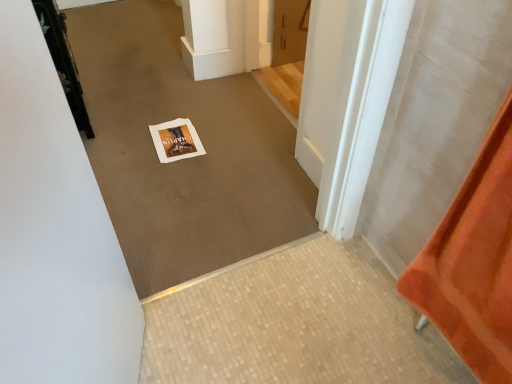
The height and width of the screenshot is (384, 512). Describe the element at coordinates (185, 159) in the screenshot. I see `white paper at center` at that location.

This screenshot has width=512, height=384. What do you see at coordinates (290, 31) in the screenshot?
I see `matte wood door at upper center, placed as the first door when sorted from right to left` at bounding box center [290, 31].

Where is `white paper at center`? The width and height of the screenshot is (512, 384). white paper at center is located at coordinates (176, 140).

Where is `white paper at center`? The image size is (512, 384). white paper at center is located at coordinates (185, 159).

Does white paper at center have a lesser width compared to white paper at center?

In fact, white paper at center might be wider than white paper at center.

Can you confirm if white paper at center is taller than white paper at center?

No.

In the scene shown: Considering their positions, is white paper at center located in front of or behind white paper at center?

In the image, white paper at center appears behind white paper at center.

Does white paper at center turn towards white paper at center?

No.

Is point (301, 60) more distant than point (188, 144)?

Yes, point (301, 60) is behind point (188, 144).

Between matte wood door at upper center, the second door viewed from the left, and white paper at center, which one has less height?

Standing shorter between the two is white paper at center.

Is matte wood door at upper center, the second door viewed from the left, oriented towards white paper at center?

No, matte wood door at upper center, the second door viewed from the left, is not turned towards white paper at center.

Is point (295, 56) positioned before point (293, 193)?

No, it is behind (293, 193).

Is white paper at center at the back of matte wood door at upper center, placed as the first door when sorted from right to left?

No, matte wood door at upper center, placed as the first door when sorted from right to left, is not facing the opposite direction of white paper at center.

Does matte wood door at upper center, placed as the first door when sorted from right to left, come behind white paper at center?

Yes, matte wood door at upper center, placed as the first door when sorted from right to left, is further from the camera.

In the scene shown: Are matte wood door at upper center, the second door viewed from the left, and white paper at center beside each other?

No, matte wood door at upper center, the second door viewed from the left, is not in contact with white paper at center.

Is matte wood door at upper center, placed as the first door when sorted from right to left, smaller than black metal door at upper left, the first door in the left-to-right sequence?

Yes, matte wood door at upper center, placed as the first door when sorted from right to left, is smaller than black metal door at upper left, the first door in the left-to-right sequence.

Is the depth of matte wood door at upper center, placed as the first door when sorted from right to left, greater than that of black metal door at upper left, which is the 2th door in right-to-left order?

That is True.

In the scene shown: How far apart are matte wood door at upper center, placed as the first door when sorted from right to left, and black metal door at upper left, the first door in the left-to-right sequence?

matte wood door at upper center, placed as the first door when sorted from right to left, is 1.18 meters from black metal door at upper left, the first door in the left-to-right sequence.

Is matte wood door at upper center, the second door viewed from the left, to the left of black metal door at upper left, which is the 2th door in right-to-left order, from the viewer's perspective?

Incorrect, matte wood door at upper center, the second door viewed from the left, is not on the left side of black metal door at upper left, which is the 2th door in right-to-left order.

Between black metal door at upper left, which is the 2th door in right-to-left order, and white paper at center, which one has less height?

white paper at center.

Considering the relative positions of black metal door at upper left, which is the 2th door in right-to-left order, and white paper at center in the image provided, is black metal door at upper left, which is the 2th door in right-to-left order, to the right of white paper at center from the viewer's perspective?

Incorrect, black metal door at upper left, which is the 2th door in right-to-left order, is not on the right side of white paper at center.

Where is `postcard below the black metal door at upper left, the first door in the left-to-right sequence (from a real-world perspective)`? postcard below the black metal door at upper left, the first door in the left-to-right sequence (from a real-world perspective) is located at coordinates click(x=176, y=140).

How many degrees apart are the facing directions of black metal door at upper left, the first door in the left-to-right sequence, and white paper at center?

The facing directions of black metal door at upper left, the first door in the left-to-right sequence, and white paper at center are 86.3 degrees apart.

Considering the relative sizes of white paper at center and matte wood door at upper center, the second door viewed from the left, in the image provided, is white paper at center thinner than matte wood door at upper center, the second door viewed from the left,?

No.

Is white paper at center behind matte wood door at upper center, the second door viewed from the left?

No, it is in front of matte wood door at upper center, the second door viewed from the left.

Considering the sizes of white paper at center and matte wood door at upper center, the second door viewed from the left, in the image, is white paper at center taller or shorter than matte wood door at upper center, the second door viewed from the left,?

white paper at center is taller than matte wood door at upper center, the second door viewed from the left.

Identify the location of plain on the left side of matte wood door at upper center, the second door viewed from the left. This screenshot has height=384, width=512. (185, 159).

Considering the positions of objects white paper at center and black metal door at upper left, which is the 2th door in right-to-left order, in the image provided, who is more to the left, white paper at center or black metal door at upper left, which is the 2th door in right-to-left order,?

Positioned to the left is black metal door at upper left, which is the 2th door in right-to-left order.

From a real-world perspective, is white paper at center positioned above or below black metal door at upper left, which is the 2th door in right-to-left order?

Clearly, from a real-world perspective, white paper at center is above black metal door at upper left, which is the 2th door in right-to-left order.

How much distance is there between white paper at center and black metal door at upper left, the first door in the left-to-right sequence?

white paper at center and black metal door at upper left, the first door in the left-to-right sequence, are 20.06 inches apart.

Between white paper at center and black metal door at upper left, the first door in the left-to-right sequence, which one is positioned behind?

black metal door at upper left, the first door in the left-to-right sequence, is more distant.

Locate an element on the screen. plain on the right of white paper at center is located at coordinates (185, 159).

Identify the location of door located behind the white paper at center. (290, 31).

Based on their spatial positions, is white paper at center or black metal door at upper left, the first door in the left-to-right sequence, further from white paper at center?

black metal door at upper left, the first door in the left-to-right sequence, is positioned further to the anchor white paper at center.

From the image, which object appears to be farther from white paper at center, white paper at center or matte wood door at upper center, the second door viewed from the left?

matte wood door at upper center, the second door viewed from the left, is further to white paper at center.

Estimate the real-world distances between objects in this image. Which object is further from white paper at center, black metal door at upper left, which is the 2th door in right-to-left order, or white paper at center?

black metal door at upper left, which is the 2th door in right-to-left order, is positioned further to the anchor white paper at center.

Based on the photo, from the image, which object appears to be nearer to matte wood door at upper center, the second door viewed from the left, white paper at center or white paper at center?

white paper at center is positioned closer to the anchor matte wood door at upper center, the second door viewed from the left.

When comparing their distances from white paper at center, does white paper at center or matte wood door at upper center, the second door viewed from the left, seem closer?

Based on the image, white paper at center appears to be nearer to white paper at center.

Looking at the image, which one is located closer to white paper at center, black metal door at upper left, which is the 2th door in right-to-left order, or matte wood door at upper center, placed as the first door when sorted from right to left?

Among the two, black metal door at upper left, which is the 2th door in right-to-left order, is located nearer to white paper at center.

Which object lies nearer to the anchor point white paper at center, matte wood door at upper center, the second door viewed from the left, or white paper at center?

Among the two, white paper at center is located nearer to white paper at center.

When comparing their distances from white paper at center, does white paper at center or black metal door at upper left, which is the 2th door in right-to-left order, seem further?

black metal door at upper left, which is the 2th door in right-to-left order, is further to white paper at center.

You are a GUI agent. You are given a task and a screenshot of the screen. Output one action in this format:
    pyautogui.click(x=<x>, y=<y>)
    Task: Click on the door between white paper at center and matte wood door at upper center, placed as the first door when sorted from right to left, from front to back
    The width and height of the screenshot is (512, 384).
    Given the screenshot: What is the action you would take?
    pyautogui.click(x=63, y=60)

Locate an element on the screen. The image size is (512, 384). postcard between white paper at center and matte wood door at upper center, placed as the first door when sorted from right to left, along the z-axis is located at coordinates (176, 140).

Find the location of a particular element. door positioned between white paper at center and white paper at center from near to far is located at coordinates (63, 60).

Find the location of a particular element. This screenshot has height=384, width=512. postcard between black metal door at upper left, the first door in the left-to-right sequence, and matte wood door at upper center, the second door viewed from the left, from left to right is located at coordinates (176, 140).